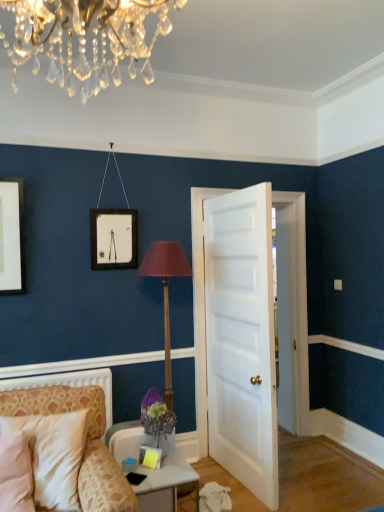
This screenshot has height=512, width=384. What do you see at coordinates (84, 438) in the screenshot?
I see `patterned fabric chair at lower left` at bounding box center [84, 438].

Measure the distance between point (163, 497) and camera.

2.41 meters.

You are a GUI agent. You are given a task and a screenshot of the screen. Output one action in this format:
    pyautogui.click(x=<x>, y=<y>)
    Task: Click on the wooden table lamp at center
    This screenshot has height=512, width=384.
    Given the screenshot: What is the action you would take?
    pyautogui.click(x=165, y=291)

Which object is more forward, patterned fabric chair at lower left or white glossy table at lower center?

white glossy table at lower center.

Between patterned fabric chair at lower left and white glossy table at lower center, which one appears on the right side from the viewer's perspective?

From the viewer's perspective, white glossy table at lower center appears more on the right side.

Who is taller, patterned fabric chair at lower left or white glossy table at lower center?

With more height is patterned fabric chair at lower left.

Is patterned fabric chair at lower left next to white glossy table at lower center?

patterned fabric chair at lower left and white glossy table at lower center are clearly separated.

Is patterned fabric chair at lower left far from white painted wood door at center?

Yes, patterned fabric chair at lower left and white painted wood door at center are quite far apart.

Is patterned fabric chair at lower left wider or thinner than white painted wood door at center?

patterned fabric chair at lower left is wider than white painted wood door at center.

From the image's perspective, between patterned fabric chair at lower left and white painted wood door at center, who is located below?

patterned fabric chair at lower left, from the image's perspective.

Is point (118, 469) farther from viewer compared to point (225, 358)?

No, it is not.

Considering the sizes of objects white glossy table at lower center and patterned fabric chair at lower left in the image provided, who is taller, white glossy table at lower center or patterned fabric chair at lower left?

patterned fabric chair at lower left is taller.

Is white glossy table at lower center positioned behind patterned fabric chair at lower left?

No, it is in front of patterned fabric chair at lower left.

Between white glossy table at lower center and patterned fabric chair at lower left, which one appears on the right side from the viewer's perspective?

Positioned to the right is white glossy table at lower center.

From the image's perspective, is patterned fabric chair at lower left above or below wooden table lamp at center?

Clearly, from the image's perspective, patterned fabric chair at lower left is below wooden table lamp at center.

From a real-world perspective, does patterned fabric chair at lower left stand above wooden table lamp at center?

No.

At what (x,y) coordinates should I click in order to perform the action: click on table lamp above the patterned fabric chair at lower left (from a real-world perspective). Please return your answer as a coordinate pair (x, y). Image resolution: width=384 pixels, height=512 pixels. Looking at the image, I should click on (165, 291).

In the image, there is a white painted wood door at center. At what (x,y) coordinates should I click in order to perform the action: click on table lamp below it (from the image's perspective). Please return your answer as a coordinate pair (x, y). Image resolution: width=384 pixels, height=512 pixels. Looking at the image, I should click on (165, 291).

Is white painted wood door at center not near wooden table lamp at center?

No.

In the scene shown: Between white painted wood door at center and wooden table lamp at center, which one appears on the right side from the viewer's perspective?

Positioned to the right is white painted wood door at center.

Which of these two, white painted wood door at center or wooden table lamp at center, is bigger?

white painted wood door at center is bigger.

From a real-world perspective, relative to white glossy table at lower center, is white painted wood door at center vertically above or below?

From a real-world perspective, white painted wood door at center is physically above white glossy table at lower center.

Which is less distant, (269, 216) or (172, 469)?

Clearly, point (269, 216) is more distant from the camera than point (172, 469).

Would you consider white painted wood door at center to be distant from white glossy table at lower center?

No, white painted wood door at center is not far away from white glossy table at lower center.

Is point (180, 258) positioned before point (224, 335)?

Yes, point (180, 258) is closer to viewer.

From the image's perspective, which is above, wooden table lamp at center or white painted wood door at center?

From the image's view, white painted wood door at center is above.

The image size is (384, 512). What are the coordinates of `table beneath the patterned fabric chair at lower left (from a real-world perspective)` in the screenshot? It's located at (169, 482).

Find the location of a particular element. chair below the white painted wood door at center (from the image's perspective) is located at coordinates (84, 438).

Considering their positions, is white painted wood door at center positioned further to white glossy table at lower center than wooden table lamp at center?

Among the two, wooden table lamp at center is located further to white glossy table at lower center.

Looking at the image, which one is located further to wooden table lamp at center, white glossy table at lower center or patterned fabric chair at lower left?

Based on the image, white glossy table at lower center appears to be further to wooden table lamp at center.

From the image, which object appears to be nearer to wooden table lamp at center, patterned fabric chair at lower left or white glossy table at lower center?

patterned fabric chair at lower left is positioned closer to the anchor wooden table lamp at center.

Looking at the image, which one is located further to white painted wood door at center, wooden table lamp at center or white glossy table at lower center?

white glossy table at lower center is positioned further to the anchor white painted wood door at center.

Based on their spatial positions, is wooden table lamp at center or white painted wood door at center closer to patterned fabric chair at lower left?

The object closer to patterned fabric chair at lower left is wooden table lamp at center.

When comparing their distances from white glossy table at lower center, does patterned fabric chair at lower left or white painted wood door at center seem closer?

patterned fabric chair at lower left is closer to white glossy table at lower center.

Based on their spatial positions, is wooden table lamp at center or patterned fabric chair at lower left further from white glossy table at lower center?

The object further to white glossy table at lower center is wooden table lamp at center.

Looking at the image, which one is located further to patterned fabric chair at lower left, white painted wood door at center or white glossy table at lower center?

white painted wood door at center is further to patterned fabric chair at lower left.

Where is `table located between patterned fabric chair at lower left and white painted wood door at center in the left-right direction`? table located between patterned fabric chair at lower left and white painted wood door at center in the left-right direction is located at coordinates (169, 482).

I want to click on door positioned between white glossy table at lower center and wooden table lamp at center from near to far, so click(x=236, y=334).

This screenshot has width=384, height=512. Find the location of `chair between white glossy table at lower center and wooden table lamp at center from front to back`. chair between white glossy table at lower center and wooden table lamp at center from front to back is located at coordinates (84, 438).

This screenshot has height=512, width=384. Find the location of `table lamp between patterned fabric chair at lower left and white painted wood door at center from left to right`. table lamp between patterned fabric chair at lower left and white painted wood door at center from left to right is located at coordinates (165, 291).